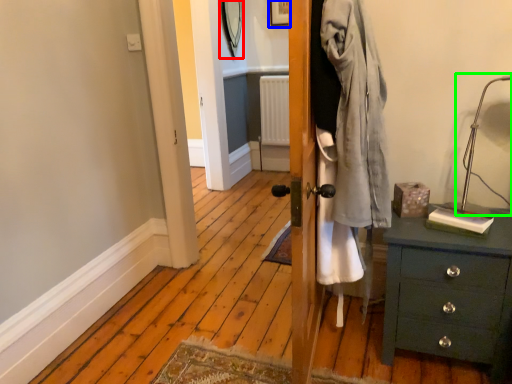
Question: Which object is positioned closest to mirror (highlighted by a red box)? Select from picture frame (highlighted by a blue box) and table lamp (highlighted by a green box).

Choices:
 (A) picture frame
 (B) table lamp

Answer: (A)